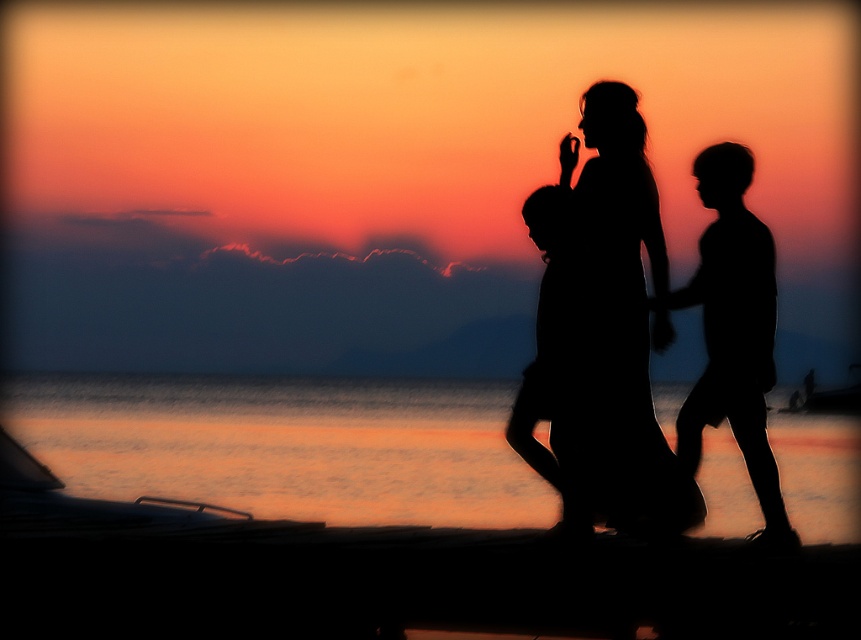
Is orange water at lower center taller than black matte figure at right?

Yes.

Between orange water at lower center and black matte figure at right, which one has more height?

Standing taller between the two is orange water at lower center.

Image resolution: width=861 pixels, height=640 pixels. In order to click on orange water at lower center in this screenshot , I will do `click(285, 445)`.

Describe the element at coordinates (667, 317) in the screenshot. I see `silhouette dress at center` at that location.

Can you confirm if silhouette dress at center is positioned to the left of black matte figure at right?

Yes, silhouette dress at center is to the left of black matte figure at right.

Is point (601, 433) positioned before point (716, 182)?

No, it is not.

Where is `silhouette dress at center`? silhouette dress at center is located at coordinates (667, 317).

Does orange water at lower center appear over silhouette child at center?

No, orange water at lower center is not above silhouette child at center.

The width and height of the screenshot is (861, 640). I want to click on orange water at lower center, so click(285, 445).